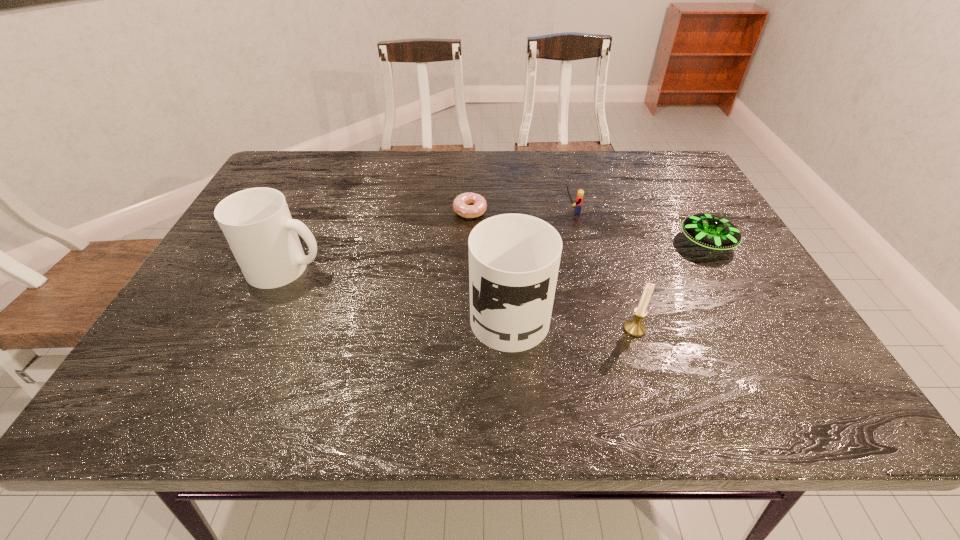
You are a GUI agent. You are given a task and a screenshot of the screen. Output one action in this format:
    pyautogui.click(x=<x>, y=<y>)
    Task: Click on the vacant area between the second object from right to left and the leftmost object
    The height and width of the screenshot is (540, 960).
    Given the screenshot: What is the action you would take?
    pyautogui.click(x=461, y=298)

At what (x,y) coordinates should I click in order to perform the action: click on vacant space in between the fourth tallest object and the fifth tallest object. Please return your answer as a coordinate pair (x, y). Image resolution: width=960 pixels, height=540 pixels. Looking at the image, I should click on (638, 227).

Locate an element on the screen. free point between the saucer and the shortest object is located at coordinates (588, 227).

Where is `empty location between the left mug and the Lego`? The width and height of the screenshot is (960, 540). empty location between the left mug and the Lego is located at coordinates (429, 239).

Locate an element on the screen. This screenshot has height=540, width=960. vacant space that is in between the third tallest object and the right mug is located at coordinates (572, 319).

You are a GUI agent. You are given a task and a screenshot of the screen. Output one action in this format:
    pyautogui.click(x=<x>, y=<y>)
    Task: Click on the free space between the shorter mug and the fifth object from left to right
    The image size is (960, 540).
    Given the screenshot: What is the action you would take?
    461,298

In order to click on vacant space in between the fourth object from left to right and the left mug in this screenshot , I will do `click(429, 239)`.

Where is `vacant point located between the rightmost object and the Lego`? This screenshot has height=540, width=960. vacant point located between the rightmost object and the Lego is located at coordinates (638, 227).

Choose which object is the nearest neighbor to the shortest object. Please provide its 2D coordinates. Your answer should be formatted as a tuple, i.e. [(x, y)], where the tuple contains the x and y coordinates of a point satisfying the conditions above.

[(514, 259)]

In order to click on object that ranks as the second closest to the shortest object in this screenshot , I will do `click(579, 199)`.